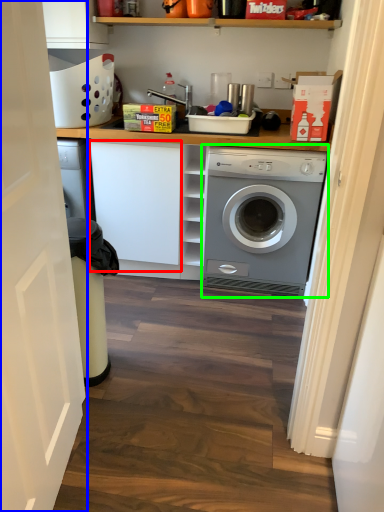
Question: Which is nearer to the cabinetry (highlighted by a red box)? door (highlighted by a blue box) or washing machine (highlighted by a green box).

Choices:
 (A) door
 (B) washing machine

Answer: (B)